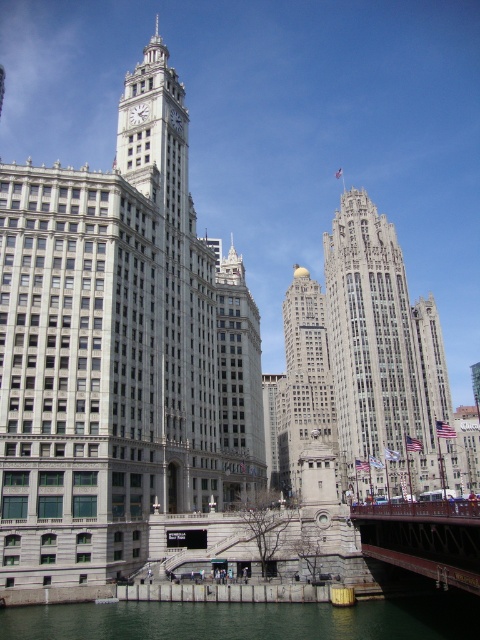
You are standing at the point labeled as point (250,620) in the image. Based on the scene description, what can you observe around this point?

The point (250,620) corresponds to greenish water at lower center, so you would observe greenish water around this point.

You are a city planner assessing the space between the Wrigley Building and the Tribune Tower. You notice the greenish water at lower center and the gold polished dome at center. Which of these two features occupies a wider horizontal space in the image?

The greenish water at lower center is wider than the gold polished dome at center, so the greenish water at lower center occupies a wider horizontal space.